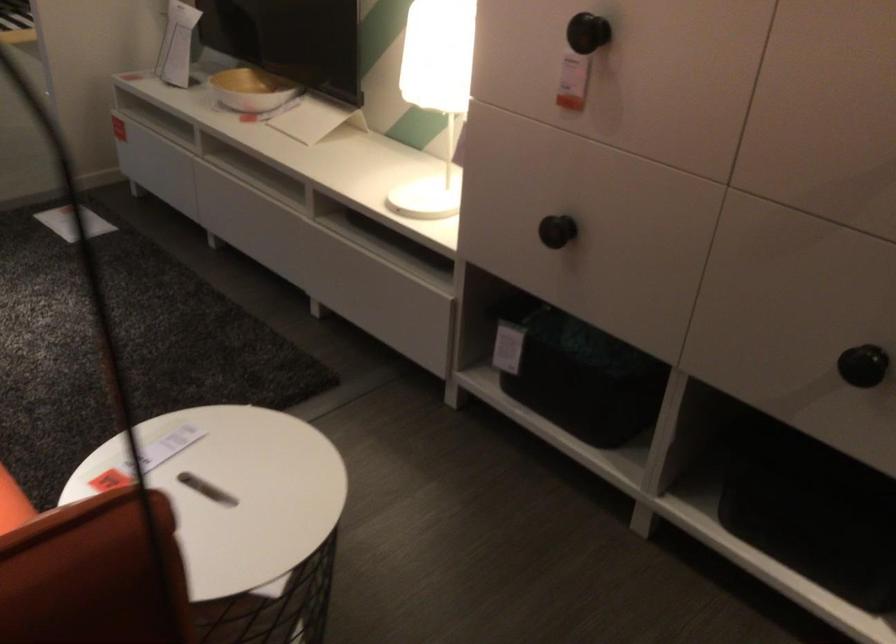
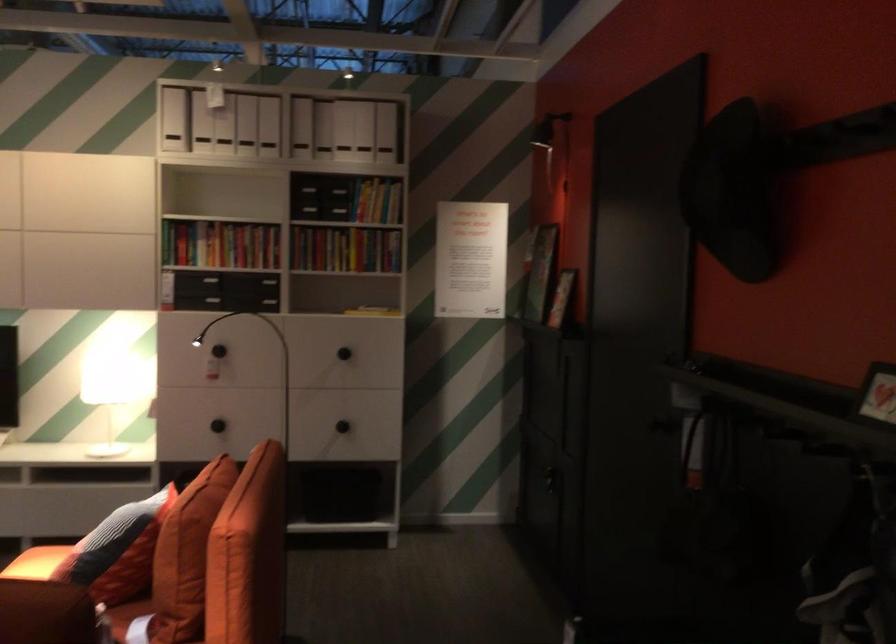
Find the pixel in the second image that matches (545,243) in the first image.

(218, 426)